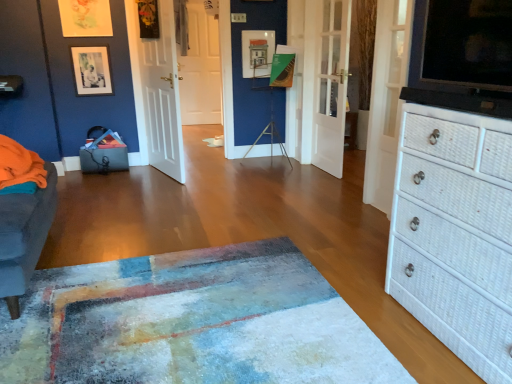
Where is `free space to the left of white wicker chest of drawers at right`? The height and width of the screenshot is (384, 512). free space to the left of white wicker chest of drawers at right is located at coordinates (379, 318).